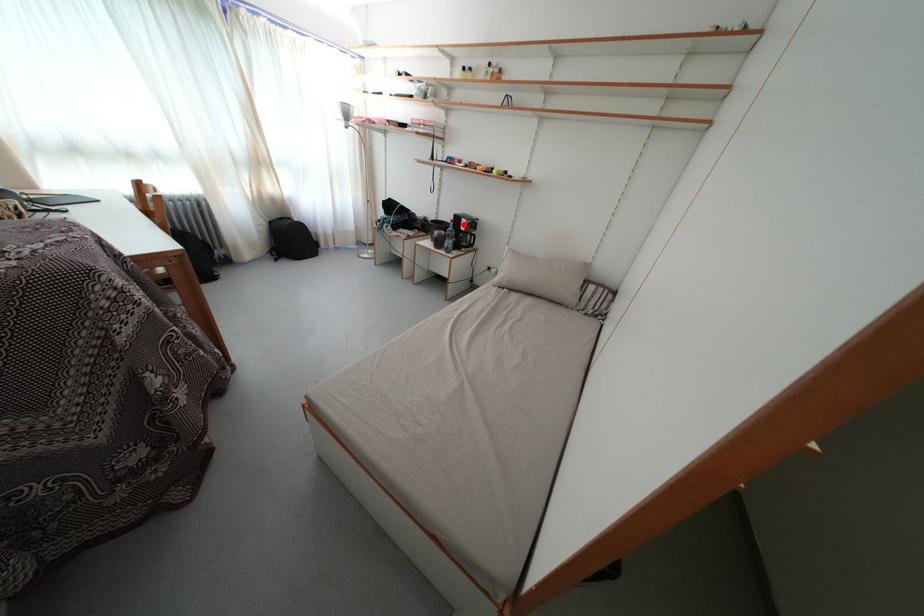
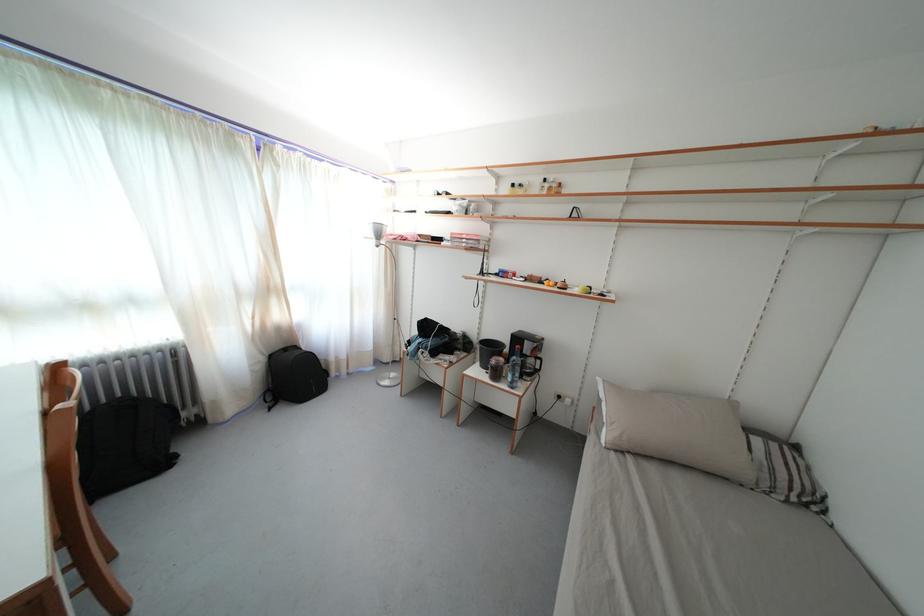
Question: A red point is marked in image1. In image2, is the corresponding 3D point closer to the camera or farther? Reply with the corresponding letter.

Choices:
 (A) The corresponding 3D point is closer.
 (B) The corresponding 3D point is farther.

Answer: (B)